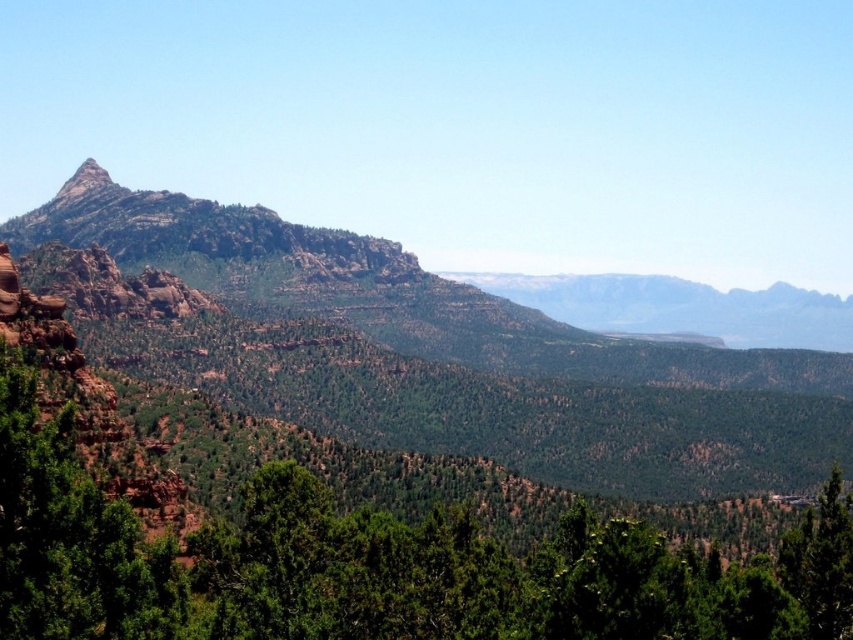
Question: Does green textured tree at center have a greater width compared to rustic rock peak at upper left?

Choices:
 (A) yes
 (B) no

Answer: (A)

Question: Can you confirm if rustic rock mountain range at left is positioned to the left of green textured tree at center?

Choices:
 (A) no
 (B) yes

Answer: (A)

Question: Which point is closer to the camera taking this photo?

Choices:
 (A) click(x=509, y=502)
 (B) click(x=38, y=512)

Answer: (B)

Question: Does green textured tree at center appear under rustic rock peak at upper left?

Choices:
 (A) no
 (B) yes

Answer: (B)

Question: Which point is farther to the camera?

Choices:
 (A) green textured tree at center
 (B) rustic rock mountain range at left
 (C) rustic rock peak at upper left

Answer: (C)

Question: Which of the following is the farthest from the observer?

Choices:
 (A) (80, 600)
 (B) (701, 397)
 (C) (90, 180)

Answer: (C)